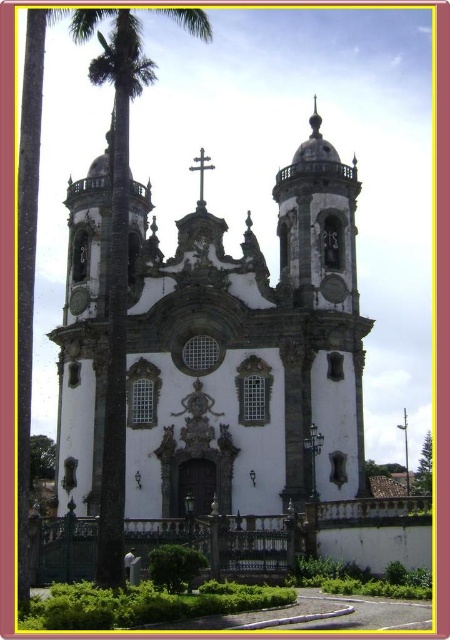
Question: Estimate the real-world distances between objects in this image. Which object is closer to the metallic cross at center?

Choices:
 (A) white stone church at center
 (B) green leafy palm tree at left

Answer: (A)

Question: Where is white stone church at center located in relation to metallic cross at center in the image?

Choices:
 (A) left
 (B) right

Answer: (B)

Question: Estimate the real-world distances between objects in this image. Which object is farther from the metallic cross at center?

Choices:
 (A) green leafy palm tree at left
 (B) white stone church at center

Answer: (A)

Question: Which object is farther from the camera taking this photo?

Choices:
 (A) green leafy palm tree at left
 (B) metallic cross at center

Answer: (B)

Question: Can you confirm if white stone church at center is thinner than green leafy palm tree at left?

Choices:
 (A) yes
 (B) no

Answer: (B)

Question: Is white stone church at center to the right of green leafy palm tree at left from the viewer's perspective?

Choices:
 (A) no
 (B) yes

Answer: (B)